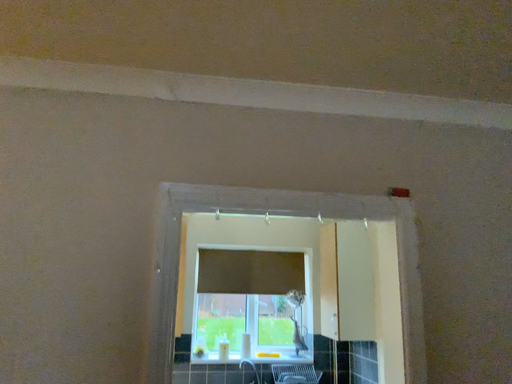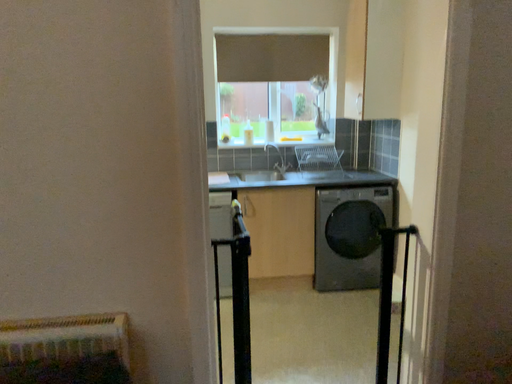
Question: Which way did the camera rotate in the video?

Choices:
 (A) rotated downward
 (B) rotated upward

Answer: (A)